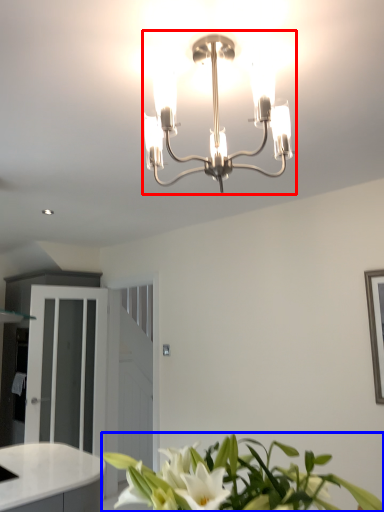
Question: Which object is closer to the camera taking this photo, lamp (highlighted by a red box) or houseplant (highlighted by a blue box)?

Choices:
 (A) lamp
 (B) houseplant

Answer: (B)